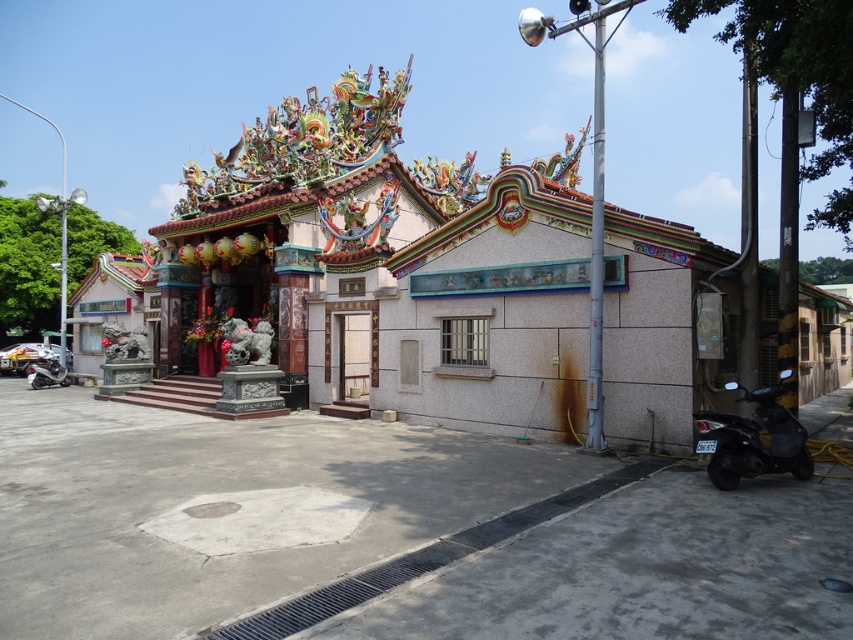
Question: Based on their relative distances, which object is farther from the white stone door at center?

Choices:
 (A) black matte motorcycle at lower right
 (B) shiny silver motorcycle at lower left

Answer: (B)

Question: Considering the relative positions of black matte motorcycle at lower right and shiny silver motorcycle at lower left in the image provided, where is black matte motorcycle at lower right located with respect to shiny silver motorcycle at lower left?

Choices:
 (A) below
 (B) above

Answer: (B)

Question: Is black matte motorcycle at lower right positioned in front of white stone door at center?

Choices:
 (A) yes
 (B) no

Answer: (A)

Question: Does black matte motorcycle at lower right have a lesser width compared to shiny silver motorcycle at lower left?

Choices:
 (A) no
 (B) yes

Answer: (B)

Question: Estimate the real-world distances between objects in this image. Which object is farther from the shiny silver motorcycle at lower left?

Choices:
 (A) black matte motorcycle at lower right
 (B) white stone door at center

Answer: (A)

Question: Estimate the real-world distances between objects in this image. Which object is closer to the white stone door at center?

Choices:
 (A) shiny silver motorcycle at lower left
 (B) black matte motorcycle at lower right

Answer: (B)